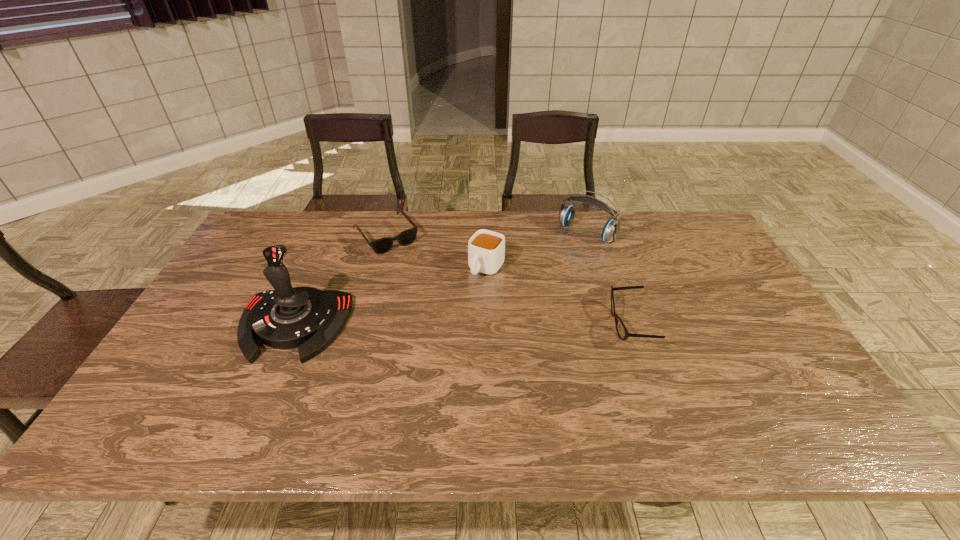
Where is `free location that satisfies the following two spatial constraints: 1. on the front side of the second tallest object; 2. on the front-facing side of the spectacles`? free location that satisfies the following two spatial constraints: 1. on the front side of the second tallest object; 2. on the front-facing side of the spectacles is located at coordinates (614, 325).